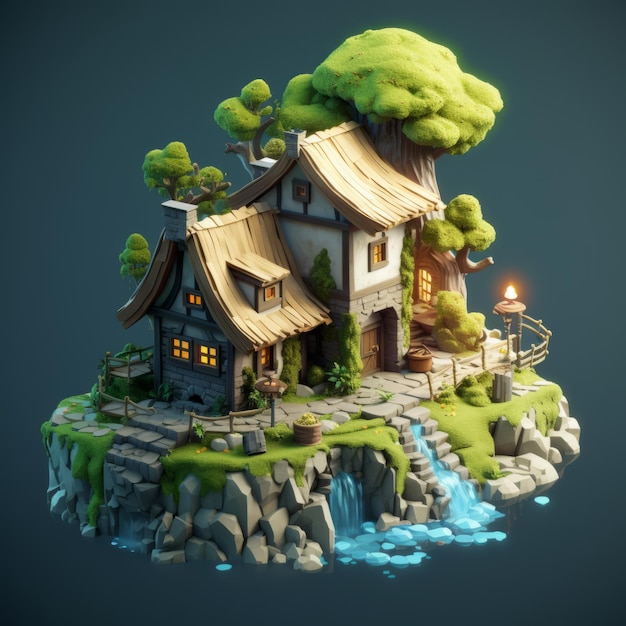
The height and width of the screenshot is (626, 626). I want to click on planters, so click(305, 429), click(419, 362).